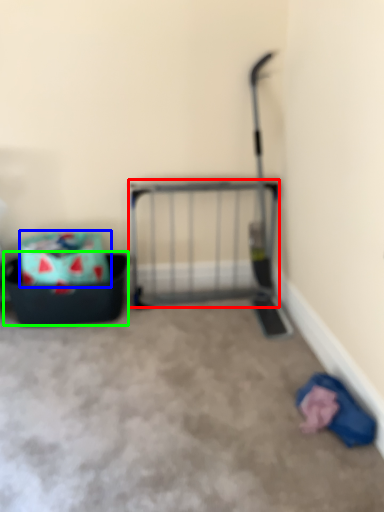
Question: Which object is the farthest from cage (highlighted by a red box)? Choose among these: storage box (highlighted by a blue box) or storage box (highlighted by a green box).

Choices:
 (A) storage box
 (B) storage box

Answer: (A)